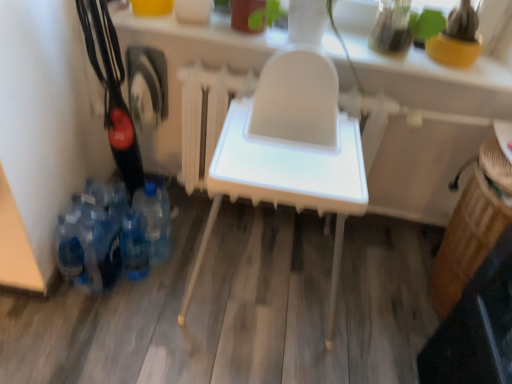
Where is `vacant location below white plastic high chair at center (from a real-world perspective)`? vacant location below white plastic high chair at center (from a real-world perspective) is located at coordinates pyautogui.click(x=260, y=279).